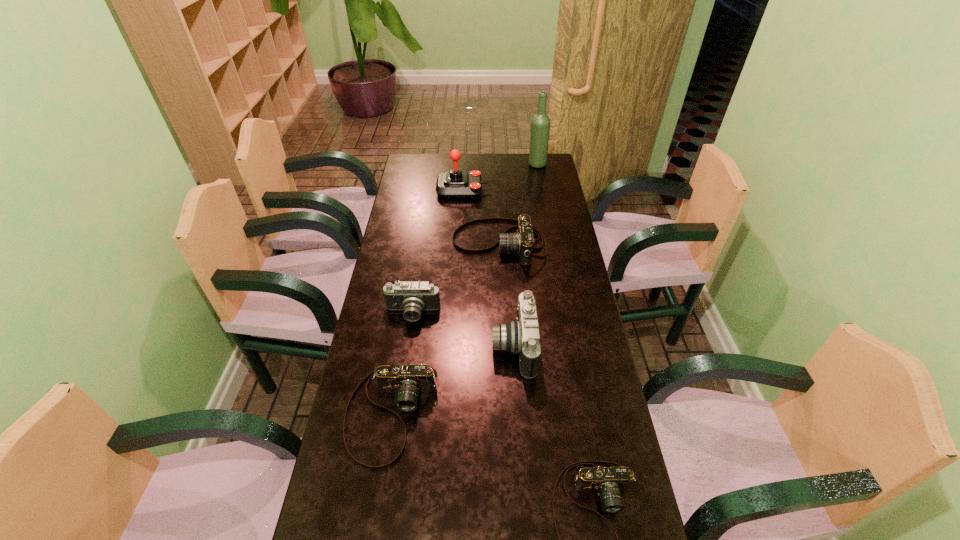
The width and height of the screenshot is (960, 540). In order to click on the farthest object in this screenshot , I will do `click(540, 124)`.

I want to click on wine bottle, so click(x=540, y=124).

Identify the location of joystick. [x=455, y=183].

Locate an element on the screen. Image resolution: width=960 pixels, height=540 pixels. the sixth nearest object is located at coordinates pos(455,183).

You are a GUI agent. You are given a task and a screenshot of the screen. Output one action in this format:
    pyautogui.click(x=<x>, y=<y>)
    Task: Click on the fifth shortest object
    Image resolution: width=960 pixels, height=540 pixels.
    Given the screenshot: What is the action you would take?
    pyautogui.click(x=522, y=335)

The height and width of the screenshot is (540, 960). Find the location of `the right black camera`. the right black camera is located at coordinates click(x=522, y=335).

The width and height of the screenshot is (960, 540). In order to click on the smaller black camera in this screenshot , I will do `click(412, 297)`.

Identify the location of the farthest camera. (522, 241).

Identify the location of the biggest brown camera. The width and height of the screenshot is (960, 540). (522, 241).

Where is `the second smallest brown camera`? the second smallest brown camera is located at coordinates (407, 381).